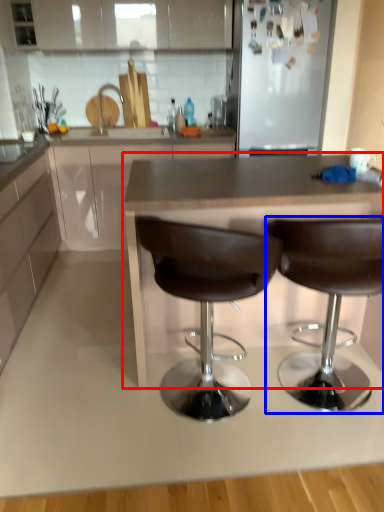
Question: Which of the following is the closest to the observer, countertop (highlighted by a red box) or chair (highlighted by a blue box)?

Choices:
 (A) countertop
 (B) chair

Answer: (B)